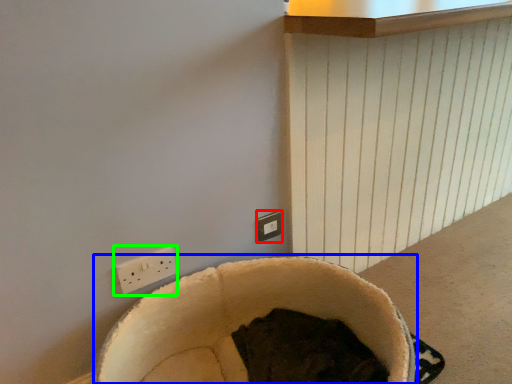
Question: Considering the real-world distances, which object is closest to electric outlet (highlighted by a red box)? bean bag chair (highlighted by a blue box) or power plugs and sockets (highlighted by a green box).

Choices:
 (A) bean bag chair
 (B) power plugs and sockets

Answer: (A)